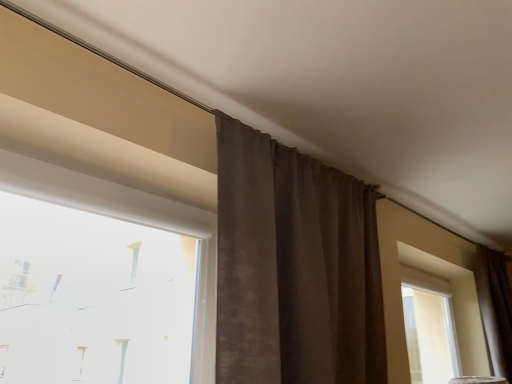
Question: Is brown textured curtain at right, which is the 2th curtain in front-to-back order, to the right of brown textured curtain at center, the second curtain from the back, from the viewer's perspective?

Choices:
 (A) no
 (B) yes

Answer: (B)

Question: Is brown textured curtain at right, which is counted as the first curtain, starting from the back, placed right next to brown textured curtain at center, the first curtain when ordered from left to right?

Choices:
 (A) no
 (B) yes

Answer: (A)

Question: From the image's perspective, is brown textured curtain at right, which is the 2th curtain in front-to-back order, under brown textured curtain at center, which is counted as the 2th curtain, starting from the right?

Choices:
 (A) yes
 (B) no

Answer: (A)

Question: Is brown textured curtain at right, which ranks as the 1th curtain in right-to-left order, located outside brown textured curtain at center, positioned as the 1th curtain in front-to-back order?

Choices:
 (A) no
 (B) yes

Answer: (B)

Question: Is brown textured curtain at right, which ranks as the 1th curtain in right-to-left order, facing towards brown textured curtain at center, which is counted as the 2th curtain, starting from the right?

Choices:
 (A) yes
 (B) no

Answer: (B)

Question: Do you think white plastic window at upper left is within brown textured curtain at center, which is counted as the 2th curtain, starting from the right, or outside of it?

Choices:
 (A) outside
 (B) inside

Answer: (A)

Question: From the image's perspective, is white plastic window at upper left positioned above or below brown textured curtain at center, which is counted as the 2th curtain, starting from the right?

Choices:
 (A) above
 (B) below

Answer: (A)

Question: In terms of height, does white plastic window at upper left look taller or shorter compared to brown textured curtain at center, the second curtain from the back?

Choices:
 (A) tall
 (B) short

Answer: (B)

Question: In terms of size, does white plastic window at upper left appear bigger or smaller than brown textured curtain at center, which is counted as the 2th curtain, starting from the right?

Choices:
 (A) small
 (B) big

Answer: (A)

Question: From a real-world perspective, is brown textured curtain at center, the second curtain from the back, above or below brown textured curtain at right, which ranks as the 1th curtain in right-to-left order?

Choices:
 (A) below
 (B) above

Answer: (B)

Question: Does point (227, 258) appear closer or farther from the camera than point (482, 258)?

Choices:
 (A) farther
 (B) closer

Answer: (B)

Question: From the image's perspective, is brown textured curtain at center, which is counted as the 2th curtain, starting from the right, positioned above or below brown textured curtain at right, which ranks as the 1th curtain in right-to-left order?

Choices:
 (A) below
 (B) above

Answer: (B)

Question: Is brown textured curtain at center, positioned as the 1th curtain in front-to-back order, wider or thinner than brown textured curtain at right, which ranks as the 1th curtain in right-to-left order?

Choices:
 (A) thin
 (B) wide

Answer: (B)

Question: From a real-world perspective, is brown textured curtain at center, the second curtain from the back, positioned above or below white plastic window at upper left?

Choices:
 (A) above
 (B) below

Answer: (A)

Question: Is brown textured curtain at center, positioned as the 1th curtain in front-to-back order, wider or thinner than white plastic window at upper left?

Choices:
 (A) thin
 (B) wide

Answer: (B)